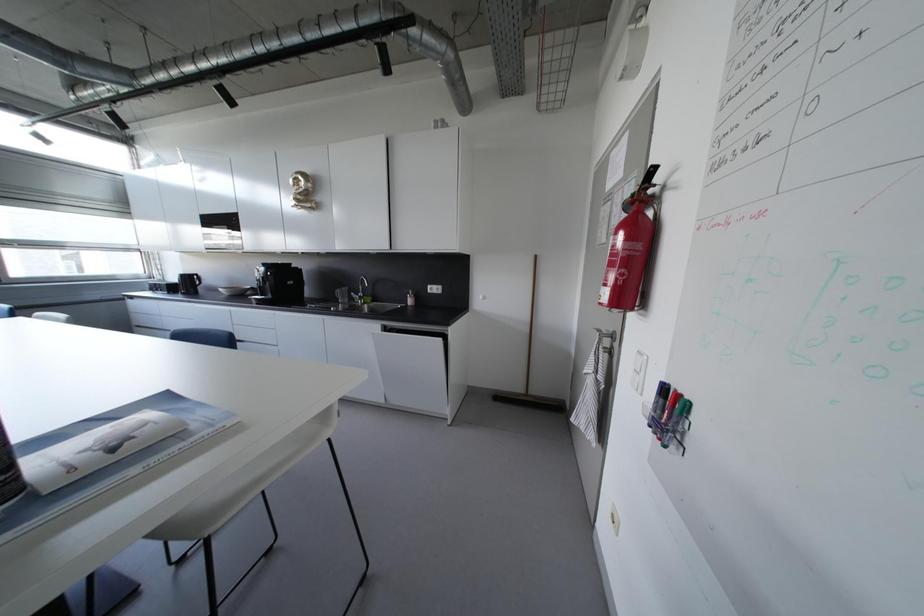
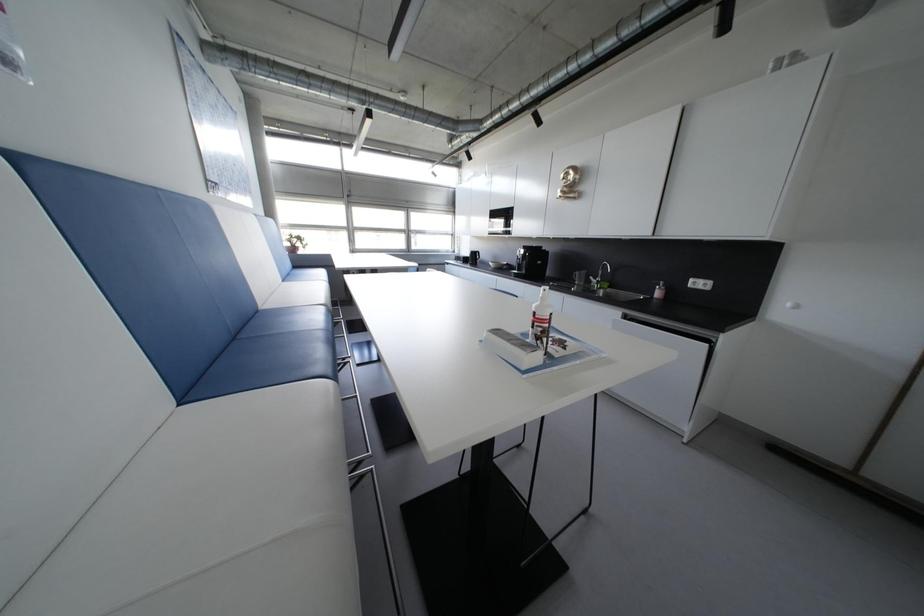
Question: Based on the continuous images, in which direction is the camera rotating? Reply with the corresponding letter.

Choices:
 (A) Left
 (B) Right
 (C) Up
 (D) Down

Answer: (A)